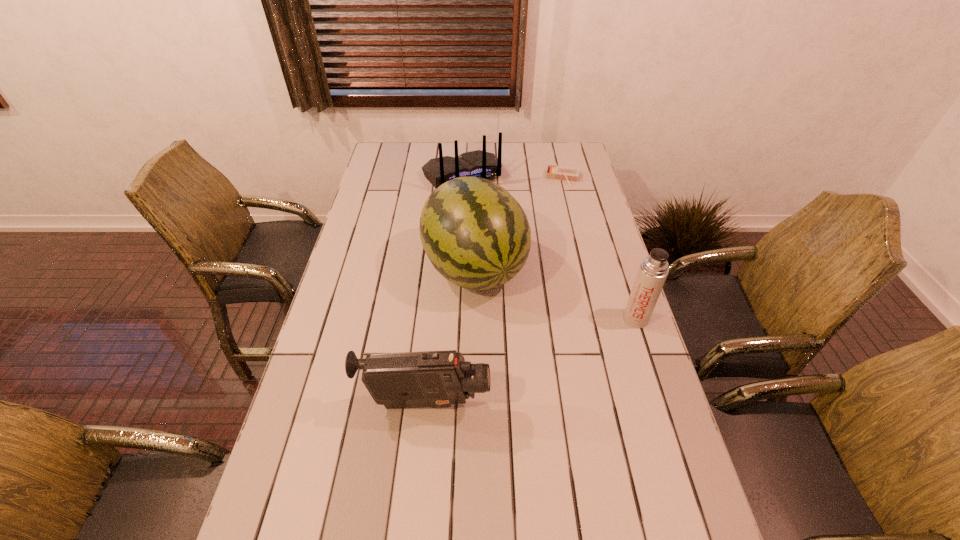
At what (x,y) coordinates should I click in order to perform the action: click on the nearest object. Please return your answer as a coordinate pair (x, y). This screenshot has width=960, height=540. Looking at the image, I should click on (437, 379).

Where is `thermos bottle`? thermos bottle is located at coordinates (653, 271).

Locate an element on the screen. The width and height of the screenshot is (960, 540). the rightmost object is located at coordinates (653, 271).

In order to click on router in this screenshot , I will do `click(479, 163)`.

I want to click on matchbox, so click(568, 174).

You are a GUI agent. You are given a task and a screenshot of the screen. Output one action in this format:
    pyautogui.click(x=<x>, y=<y>)
    Task: Click on the second object from right to left
    This screenshot has height=540, width=960.
    Given the screenshot: What is the action you would take?
    point(568,174)

At what (x,y) coordinates should I click in order to perform the action: click on the tallest object. Please return your answer as a coordinate pair (x, y). Image resolution: width=960 pixels, height=540 pixels. Looking at the image, I should click on (476, 235).

Image resolution: width=960 pixels, height=540 pixels. Identify the location of vacant space positioned on the front-facing side of the nearest object. (551, 404).

Find the location of a particular element. Image resolution: width=960 pixels, height=540 pixels. vacant space located on the back of the thermos bottle is located at coordinates (626, 289).

At what (x,y) coordinates should I click in order to perform the action: click on vacant space located on the back of the router. Please return your answer as a coordinate pair (x, y). Image resolution: width=960 pixels, height=540 pixels. Looking at the image, I should click on (490, 217).